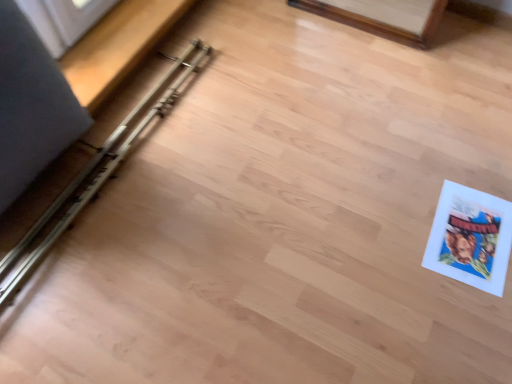
The width and height of the screenshot is (512, 384). Find the location of `free space behind white paper comic book at lower right`. free space behind white paper comic book at lower right is located at coordinates (444, 161).